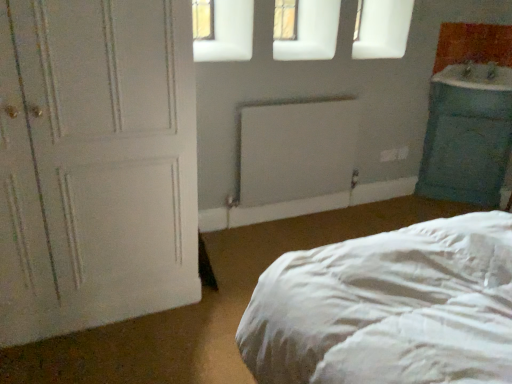
Question: From the image's perspective, is teal fabric pillow at right located above white matte radiator at center?

Choices:
 (A) no
 (B) yes

Answer: (B)

Question: Considering the relative sizes of teal fabric pillow at right and white matte radiator at center in the image provided, is teal fabric pillow at right wider than white matte radiator at center?

Choices:
 (A) yes
 (B) no

Answer: (A)

Question: Does teal fabric pillow at right have a smaller size compared to white matte radiator at center?

Choices:
 (A) yes
 (B) no

Answer: (B)

Question: From the image's perspective, does teal fabric pillow at right appear lower than white matte radiator at center?

Choices:
 (A) yes
 (B) no

Answer: (B)

Question: Is teal fabric pillow at right oriented towards white matte radiator at center?

Choices:
 (A) no
 (B) yes

Answer: (B)

Question: Is teal fabric pillow at right facing away from white matte radiator at center?

Choices:
 (A) yes
 (B) no

Answer: (B)

Question: Is blue glossy sink at right closer to the viewer compared to white matte radiator at center?

Choices:
 (A) no
 (B) yes

Answer: (A)

Question: Is the depth of blue glossy sink at right greater than that of white matte radiator at center?

Choices:
 (A) no
 (B) yes

Answer: (B)

Question: Is blue glossy sink at right aimed at white matte radiator at center?

Choices:
 (A) no
 (B) yes

Answer: (A)

Question: Does blue glossy sink at right appear on the left side of white matte radiator at center?

Choices:
 (A) no
 (B) yes

Answer: (A)

Question: From the image's perspective, is blue glossy sink at right beneath white matte radiator at center?

Choices:
 (A) no
 (B) yes

Answer: (A)

Question: Is blue glossy sink at right turned away from white matte radiator at center?

Choices:
 (A) yes
 (B) no

Answer: (B)

Question: Is white matte door at left facing towards white matte radiator at center?

Choices:
 (A) yes
 (B) no

Answer: (B)